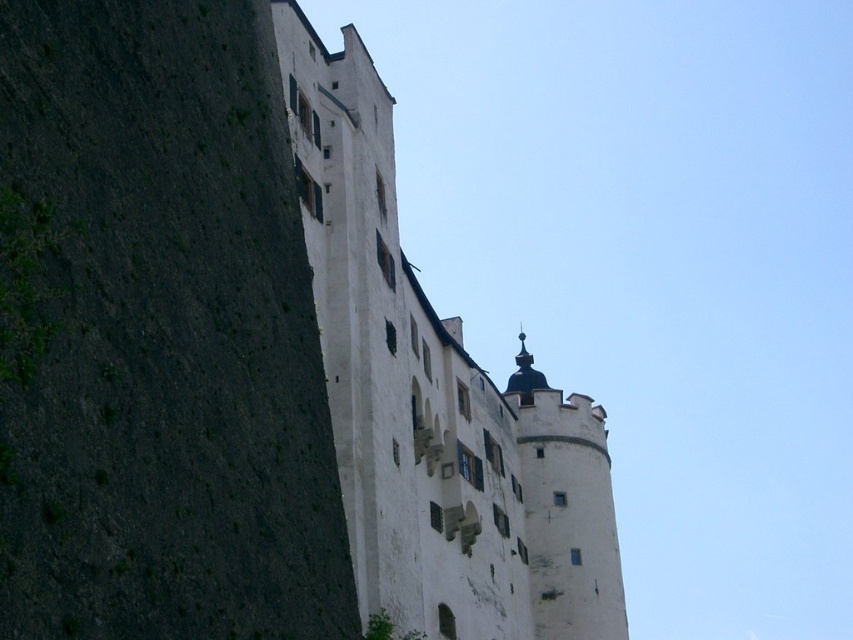
You are a tour guide leading a group through the castle grounds. You want to point out the dark gray stone wall at left and the white stone castle at center to your visitors. Can you fit both landmarks within your camera frame if your camera has a maximum horizontal field of view of 15 meters?

The dark gray stone wall at left and white stone castle at center are 18.19 meters apart, which exceeds the camera field of view of 15 meters. Therefore, you cannot fit both landmarks within the camera frame.

You are a tourist standing in front of the castle and want to take a photo that includes both the dark gray stone wall at left and the white stone castle at center. Which object should you position closer to the edge of the frame to ensure both are fully visible?

Since the dark gray stone wall at left is smaller than the white stone castle at center, you should position the dark gray stone wall at left closer to the edge of the frame to ensure both are fully visible.

You are standing in a historic square and see the white stone castle at center. If you want to take a photo of it from a distance that is exactly 50 meters away, is your current position suitable?

The white stone castle at center is 50.46 meters away from the viewer. Since 50.46 meters is slightly more than 50 meters, your current position is just a bit farther away than the desired distance of 50 meters.